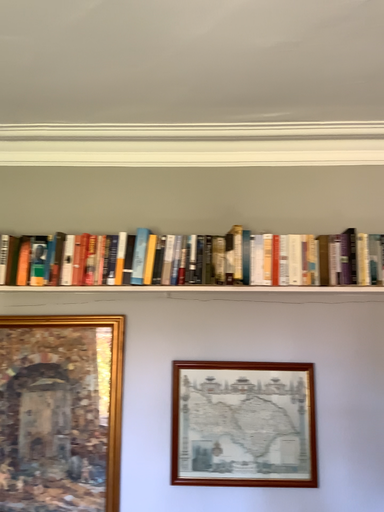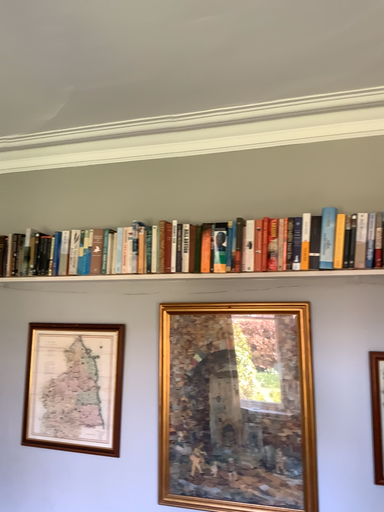
Question: How did the camera likely rotate when shooting the video?

Choices:
 (A) rotated left
 (B) rotated right

Answer: (A)